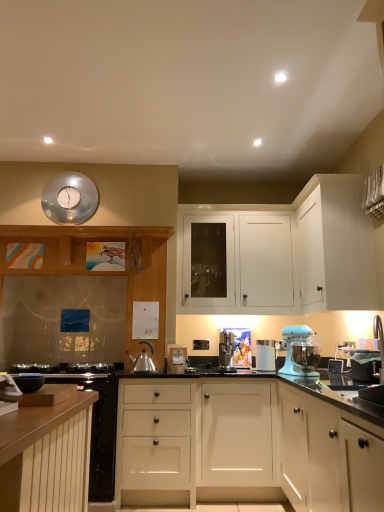
At what (x,y) coordinates should I click in order to perform the action: click on free spot above metallic reflective clock at upper center (from a real-world perspective). Please return your answer as a coordinate pair (x, y). This screenshot has width=384, height=512. Looking at the image, I should click on (68, 170).